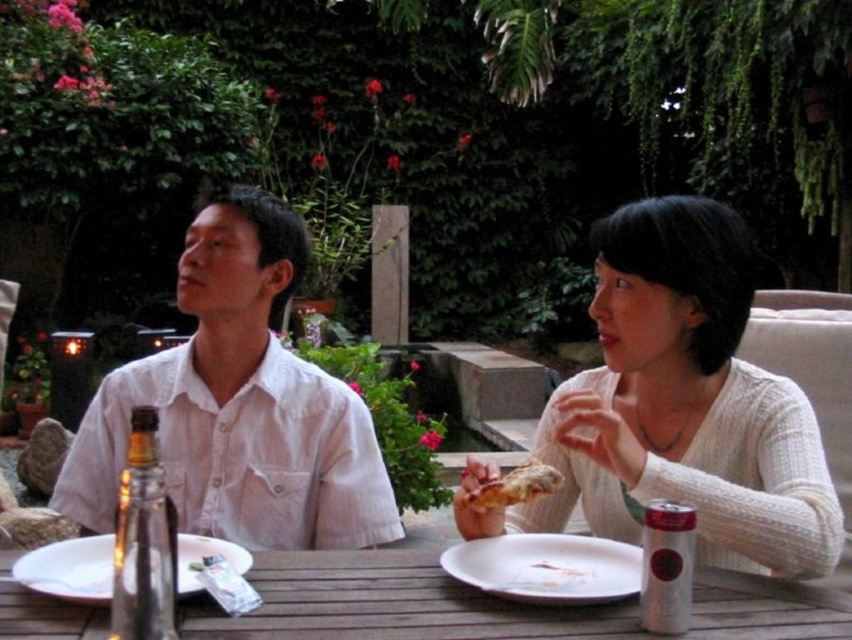
You are standing in front of the outdoor dining table in the garden. You see two points marked on the table surface. The first point is at coordinate point (665, 248) and the second is at point (350, 420). Which point is closer to you?

Point (665, 248) is closer to the camera than point (350, 420), so the first point is closer to you.